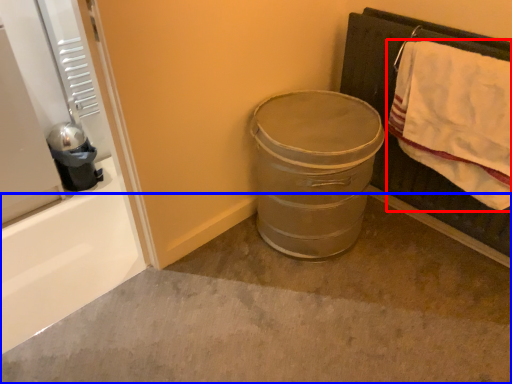
Question: Among these objects, which one is farthest to the camera, bath towel (highlighted by a red box) or concrete (highlighted by a blue box)?

Choices:
 (A) bath towel
 (B) concrete

Answer: (A)